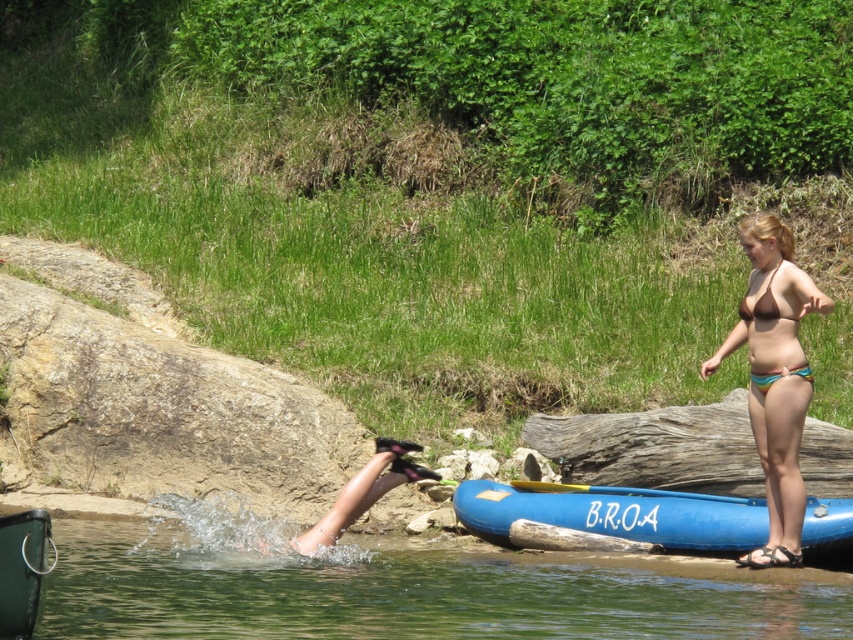
You are planning to launch a small toy boat that requires at least 1 meter of depth. Based on the scene, which object, clear water at lower left or blue rubber canoe at lower right, would be the best location to place the boat?

The clear water at lower left is taller than the blue rubber canoe at lower right, so the clear water at lower left would be the best location to place the boat since it has sufficient depth for the toy boat requiring at least 1 meter of depth.

You are a photographer trying to capture a shot of the brown matte bikini top at upper right and the yellow wood paddle at lower center. Which object should you focus on first if you want to ensure both are in the frame without moving the camera?

A: The yellow wood paddle at lower center is positioned under the brown matte bikini top at upper right, so focusing on the paddle first will ensure the bikini top remains in the frame above it.

You are trying to decide whether to stand on the gray rough log at center or the yellow wood paddle at lower center. Which one is taller and more stable to stand on?

The gray rough log at center has a greater height compared to the yellow wood paddle at lower center, so it is taller and more stable to stand on.